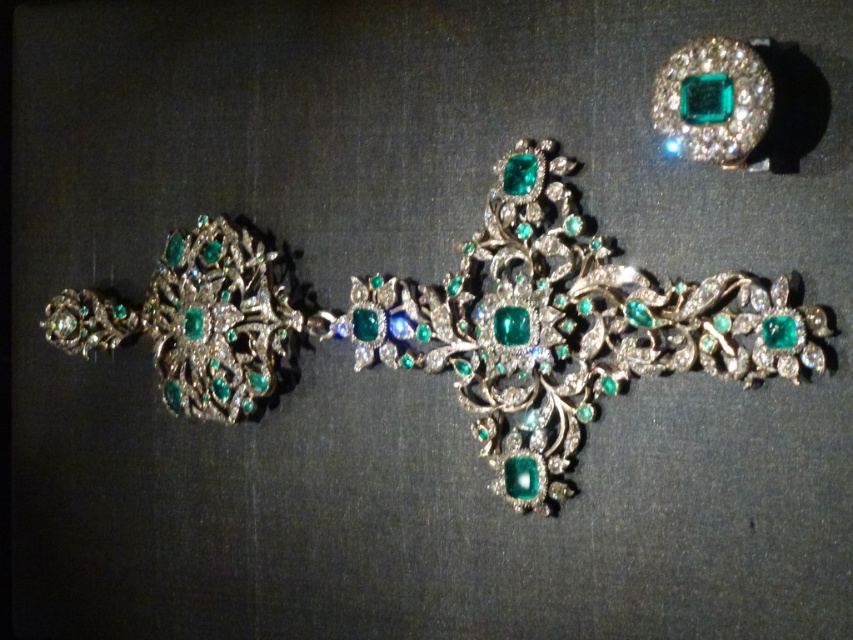
Does matte silver brooch at center-left have a lesser width compared to emerald-cut gemstone at upper right?

In fact, matte silver brooch at center-left might be wider than emerald-cut gemstone at upper right.

This screenshot has height=640, width=853. I want to click on matte silver brooch at center-left, so click(x=459, y=324).

Identify the location of matte silver brooch at center-left. This screenshot has width=853, height=640. (459, 324).